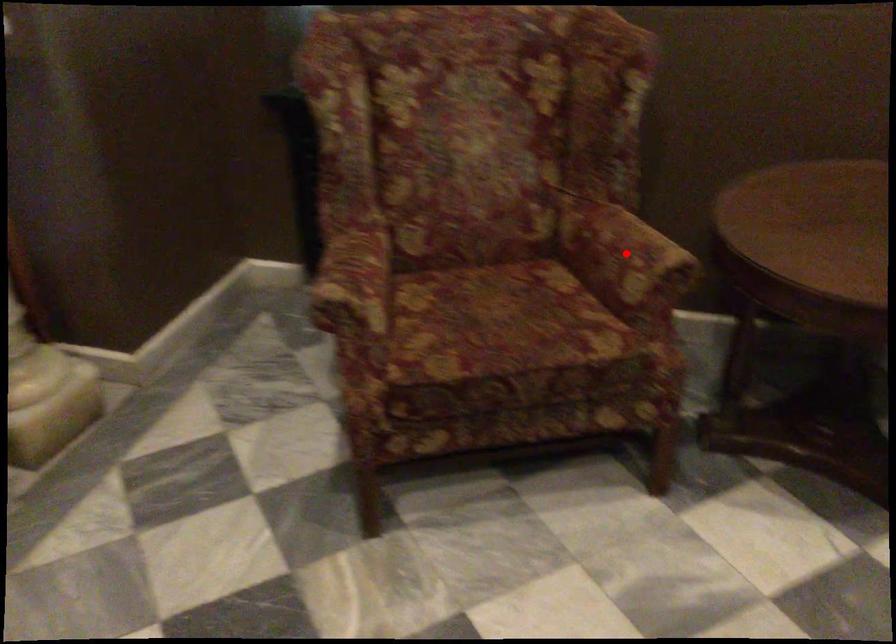
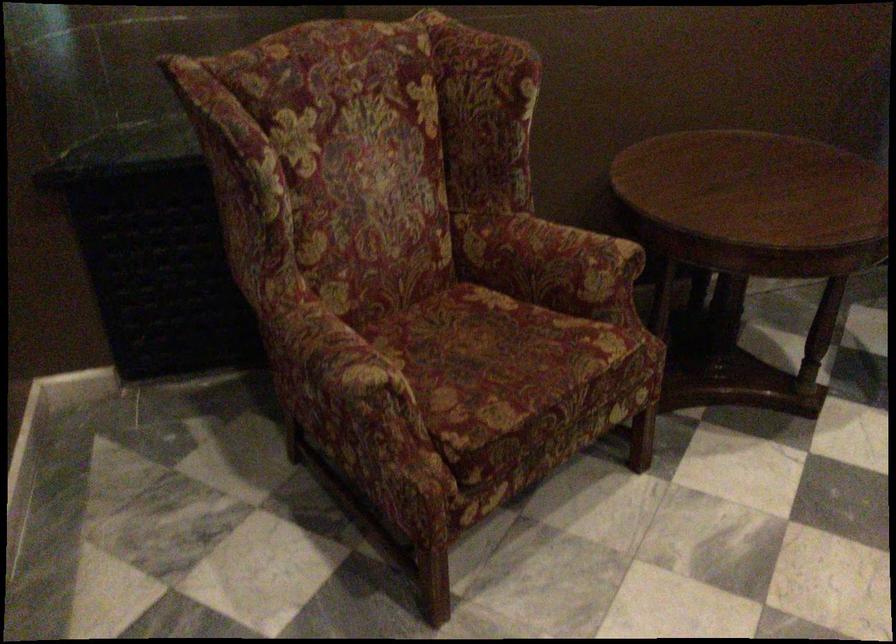
Question: I am providing you with two images of the same scene from different viewpoints. A red point is marked on the first image. At the location where the point appears in image 1, is it still visible in image 2?

Choices:
 (A) Yes
 (B) No

Answer: (A)